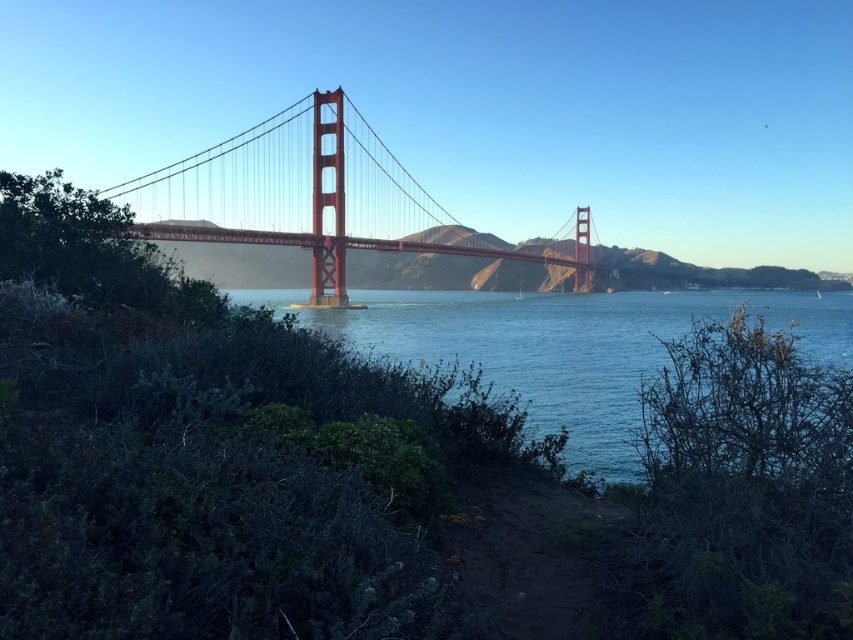
Question: Which point appears closest to the camera in this image?

Choices:
 (A) (625, 445)
 (B) (360, 240)

Answer: (A)

Question: Does blue water at center appear on the left side of metallic red suspension bridge at center?

Choices:
 (A) no
 (B) yes

Answer: (A)

Question: Considering the relative positions of blue water at center and metallic red suspension bridge at center in the image provided, where is blue water at center located with respect to metallic red suspension bridge at center?

Choices:
 (A) above
 (B) below

Answer: (B)

Question: Among these points, which one is farthest from the camera?

Choices:
 (A) (573, 259)
 (B) (474, 337)

Answer: (A)

Question: Is blue water at center to the left of metallic red suspension bridge at center from the viewer's perspective?

Choices:
 (A) yes
 (B) no

Answer: (B)

Question: Among these objects, which one is farthest from the camera?

Choices:
 (A) blue water at center
 (B) metallic red suspension bridge at center

Answer: (B)